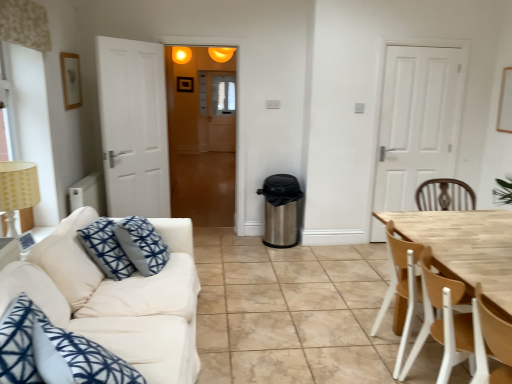
Question: Can you confirm if white fabric couch at left is taller than matte orange light fixture at upper center?

Choices:
 (A) yes
 (B) no

Answer: (A)

Question: Considering the relative sizes of white fabric couch at left and matte orange light fixture at upper center in the image provided, is white fabric couch at left wider than matte orange light fixture at upper center?

Choices:
 (A) no
 (B) yes

Answer: (B)

Question: From a real-world perspective, does white fabric couch at left sit lower than matte orange light fixture at upper center?

Choices:
 (A) no
 (B) yes

Answer: (B)

Question: Is white fabric couch at left thinner than matte orange light fixture at upper center?

Choices:
 (A) yes
 (B) no

Answer: (B)

Question: From the image's perspective, is white fabric couch at left beneath matte orange light fixture at upper center?

Choices:
 (A) yes
 (B) no

Answer: (A)

Question: Would you consider white fabric couch at left to be distant from matte orange light fixture at upper center?

Choices:
 (A) no
 (B) yes

Answer: (B)

Question: From the image's perspective, does beige fabric lampshade at left appear lower than translucent wooden door at center?

Choices:
 (A) yes
 (B) no

Answer: (A)

Question: From a real-world perspective, is beige fabric lampshade at left over translucent wooden door at center?

Choices:
 (A) yes
 (B) no

Answer: (B)

Question: Does beige fabric lampshade at left have a smaller size compared to translucent wooden door at center?

Choices:
 (A) yes
 (B) no

Answer: (A)

Question: Is beige fabric lampshade at left turned away from translucent wooden door at center?

Choices:
 (A) yes
 (B) no

Answer: (B)

Question: From the image's perspective, does beige fabric lampshade at left appear higher than translucent wooden door at center?

Choices:
 (A) no
 (B) yes

Answer: (A)

Question: Is beige fabric lampshade at left oriented towards translucent wooden door at center?

Choices:
 (A) yes
 (B) no

Answer: (B)

Question: Can you confirm if light brown wood chair at right, the second chair from the back, is bigger than white fabric couch at left?

Choices:
 (A) no
 (B) yes

Answer: (A)